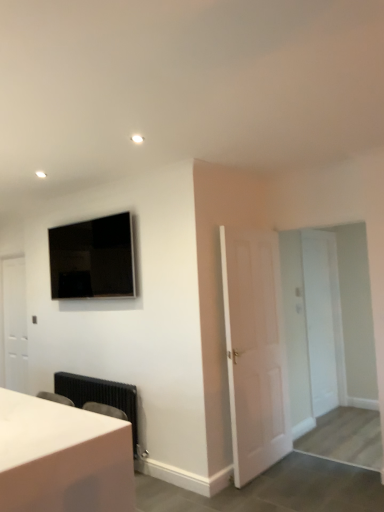
Question: Is flat screen tv at upper left with white matte door at center, the 3th door in the left-to-right sequence?

Choices:
 (A) no
 (B) yes

Answer: (A)

Question: From a real-world perspective, is flat screen tv at upper left positioned over white matte door at center, the first door viewed from the right, based on gravity?

Choices:
 (A) no
 (B) yes

Answer: (B)

Question: Is flat screen tv at upper left oriented away from white matte door at center, the first door viewed from the right?

Choices:
 (A) yes
 (B) no

Answer: (A)

Question: Does flat screen tv at upper left have a greater width compared to white matte door at center, marked as the 2th door in a back-to-front arrangement?

Choices:
 (A) yes
 (B) no

Answer: (A)

Question: Is flat screen tv at upper left bigger than white matte door at center, the first door viewed from the right?

Choices:
 (A) yes
 (B) no

Answer: (A)

Question: Is flat screen tv at upper left to the left or to the right of white matte door at center, the 3th door in the left-to-right sequence, in the image?

Choices:
 (A) right
 (B) left

Answer: (B)

Question: Relative to white matte door at center, acting as the 2th door starting from the front, is flat screen tv at upper left in front or behind?

Choices:
 (A) behind
 (B) front

Answer: (B)

Question: From a real-world perspective, relative to white matte door at center, the 3th door in the left-to-right sequence, is flat screen tv at upper left vertically above or below?

Choices:
 (A) below
 (B) above

Answer: (B)

Question: Considering the positions of flat screen tv at upper left and white matte door at center, acting as the 2th door starting from the front, in the image, is flat screen tv at upper left bigger or smaller than white matte door at center, acting as the 2th door starting from the front,?

Choices:
 (A) small
 (B) big

Answer: (B)

Question: Considering the positions of white matte door at center, the 3th door in the left-to-right sequence, and flat screen tv at upper left in the image, is white matte door at center, the 3th door in the left-to-right sequence, bigger or smaller than flat screen tv at upper left?

Choices:
 (A) small
 (B) big

Answer: (A)

Question: From the image's perspective, is white matte door at center, the 3th door in the left-to-right sequence, located above or below flat screen tv at upper left?

Choices:
 (A) above
 (B) below

Answer: (B)

Question: From a real-world perspective, is white matte door at center, the 3th door in the left-to-right sequence, physically located above or below flat screen tv at upper left?

Choices:
 (A) below
 (B) above

Answer: (A)

Question: Is white matte door at center, marked as the 2th door in a back-to-front arrangement, situated inside flat screen tv at upper left or outside?

Choices:
 (A) inside
 (B) outside

Answer: (B)

Question: From a real-world perspective, is white matte door at left, which ranks as the first door in back-to-front order, positioned above or below white glossy table at lower left?

Choices:
 (A) above
 (B) below

Answer: (A)

Question: Is white matte door at left, placed as the 3th door when sorted from right to left, spatially inside white glossy table at lower left, or outside of it?

Choices:
 (A) outside
 (B) inside

Answer: (A)